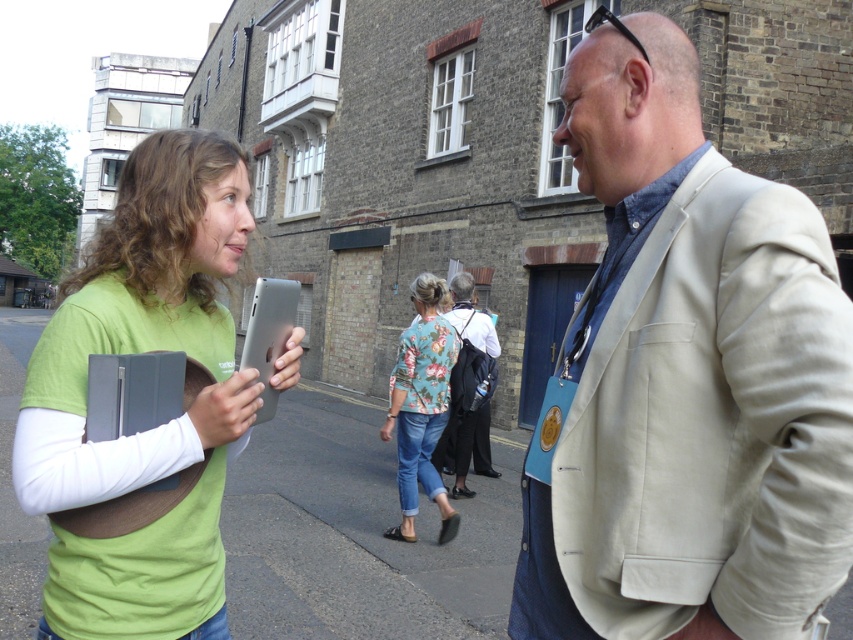
You are a delivery person who needs to place a package on the ground. You see the gray asphalt at center and the black leather jacket at center. Which surface should you choose to place the package?

The gray asphalt at center is above the black leather jacket at center, so placing the package on the gray asphalt at center would be the appropriate choice as it is higher and likely more accessible for delivery purposes.

You are a photographer trying to capture a portrait of both the beige fabric jacket at center and the floral fabric blouse at center in the same frame. Based on their positions, which one should you focus on first to ensure both are in the frame?

The beige fabric jacket at center is positioned on the right side of the floral fabric blouse at center, so you should focus on the floral fabric blouse at center first to ensure both are in the frame.

You are a tailor observing two people in the image. You need to determine which fabric item is higher on their bodies. Which one is positioned higher between the beige fabric jacket at center and the floral fabric blouse at center?

The beige fabric jacket at center is positioned higher than the floral fabric blouse at center.